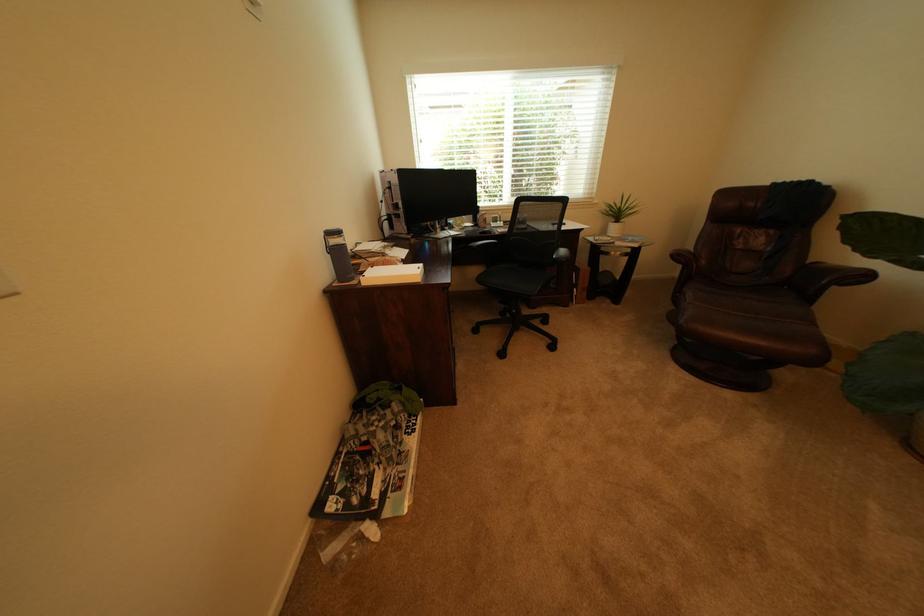
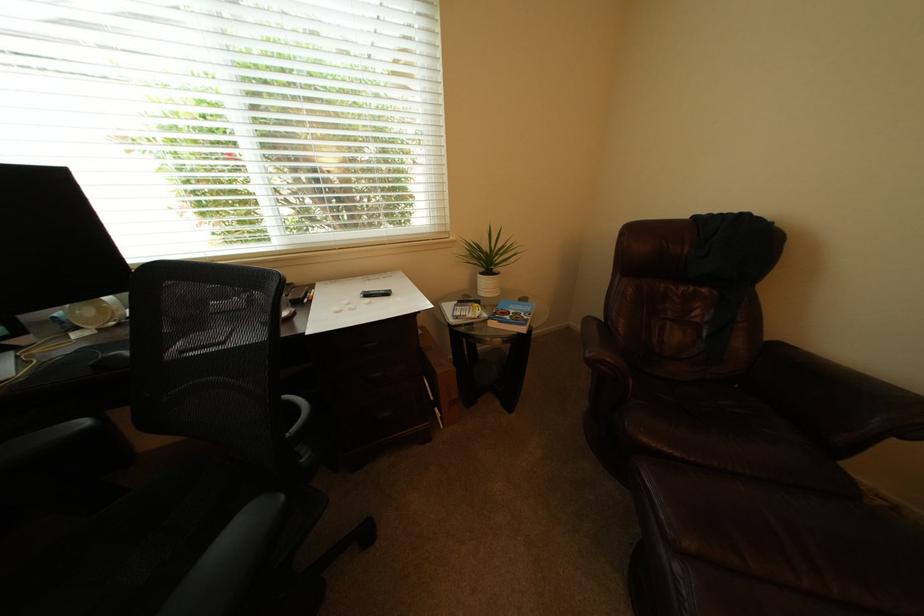
In the second image, find the point that corresponds to [624,243] in the first image.

(495, 317)